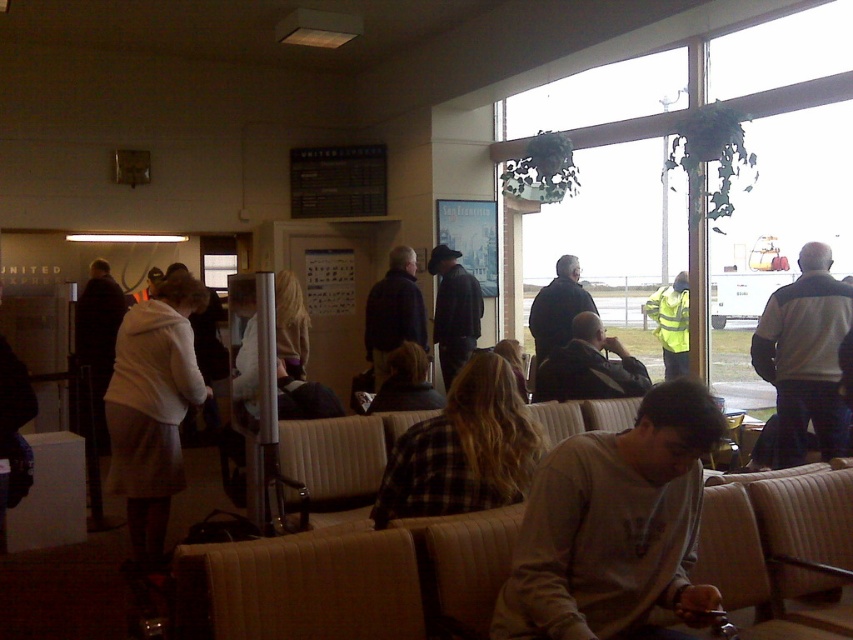
Question: Estimate the real-world distances between objects in this image. Which object is closer to the gray sweatshirt at center?

Choices:
 (A) white fabric at left
 (B) dark blue jeans at center
 (C) dark gray sweater at center
 (D) dark brown leather jacket at center

Answer: (A)

Question: Among these objects, which one is farthest from the camera?

Choices:
 (A) plaid shirt at center
 (B) dark blue jeans at center
 (C) white fabric at left
 (D) gray and black jacket at right

Answer: (B)

Question: Does dark blue jeans at center appear under dark gray sweater at center?

Choices:
 (A) no
 (B) yes

Answer: (B)

Question: Where is dark brown leather jacket at center located in relation to high visibility yellow jacket at center in the image?

Choices:
 (A) left
 (B) right

Answer: (A)

Question: Which of the following is the farthest from the observer?

Choices:
 (A) (401, 268)
 (B) (469, 508)
 (C) (120, 410)

Answer: (A)

Question: In this image, where is plaid shirt at center located relative to dark gray sweater at center?

Choices:
 (A) left
 (B) right

Answer: (A)